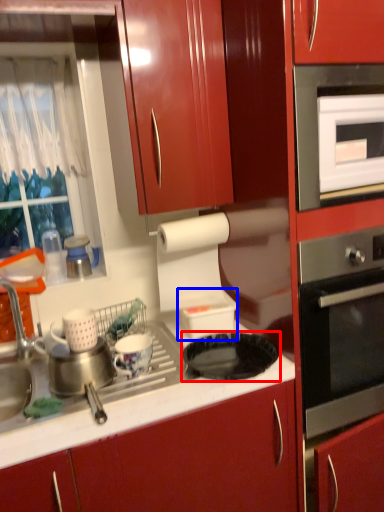
Question: Which object is further to the camera taking this photo, gas stove (highlighted by a red box) or appliance (highlighted by a blue box)?

Choices:
 (A) gas stove
 (B) appliance

Answer: (B)